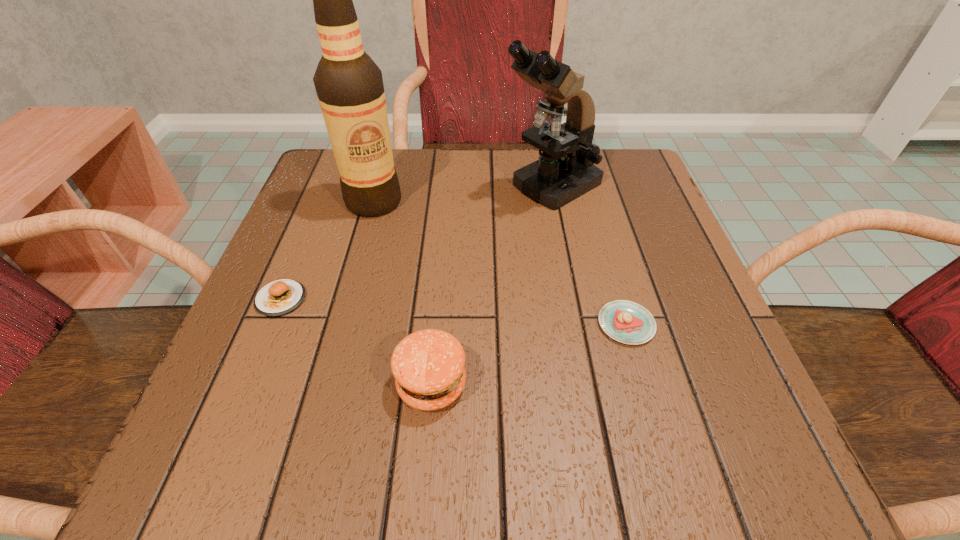
Locate an element on the screen. This screenshot has height=540, width=960. object located at the far left corner is located at coordinates (349, 85).

Locate an element on the screen. This screenshot has width=960, height=540. object situated at the far right corner is located at coordinates (565, 171).

You are a GUI agent. You are given a task and a screenshot of the screen. Output one action in this format:
    pyautogui.click(x=<x>, y=<y>)
    Task: Click on the free location at the far edge
    This screenshot has height=540, width=960.
    Given the screenshot: What is the action you would take?
    pyautogui.click(x=487, y=204)

Identify the location of free space at the near edge of the desktop. (372, 444).

In order to click on vacant area at the left edge in this screenshot , I will do `click(356, 279)`.

Image resolution: width=960 pixels, height=540 pixels. Find the location of `vacant space at the right edge of the desktop`. vacant space at the right edge of the desktop is located at coordinates (617, 237).

The width and height of the screenshot is (960, 540). In order to click on vacant area at the far left corner of the desktop in this screenshot , I will do `click(316, 196)`.

Where is `free location at the near left corner of the desktop`? free location at the near left corner of the desktop is located at coordinates (304, 424).

Image resolution: width=960 pixels, height=540 pixels. In the image, there is a desktop. What are the coordinates of `free space at the far right corner` in the screenshot? It's located at (646, 179).

At what (x,y) coordinates should I click in order to perform the action: click on vacant space at the near right corner of the desktop. Please return your answer as a coordinate pair (x, y). The height and width of the screenshot is (540, 960). Looking at the image, I should click on (700, 478).